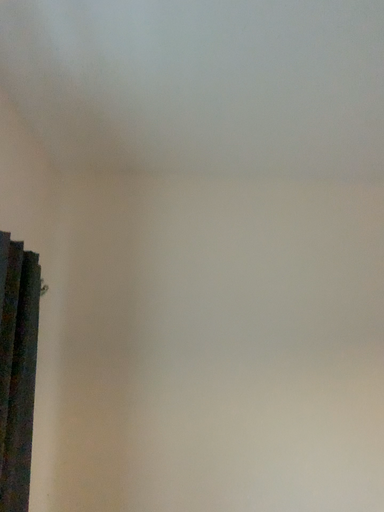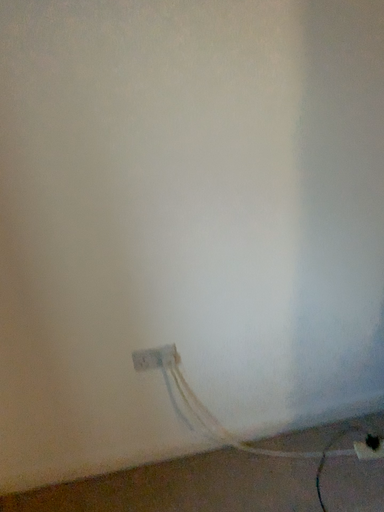
Question: Which way did the camera rotate in the video?

Choices:
 (A) rotated left
 (B) rotated right

Answer: (B)